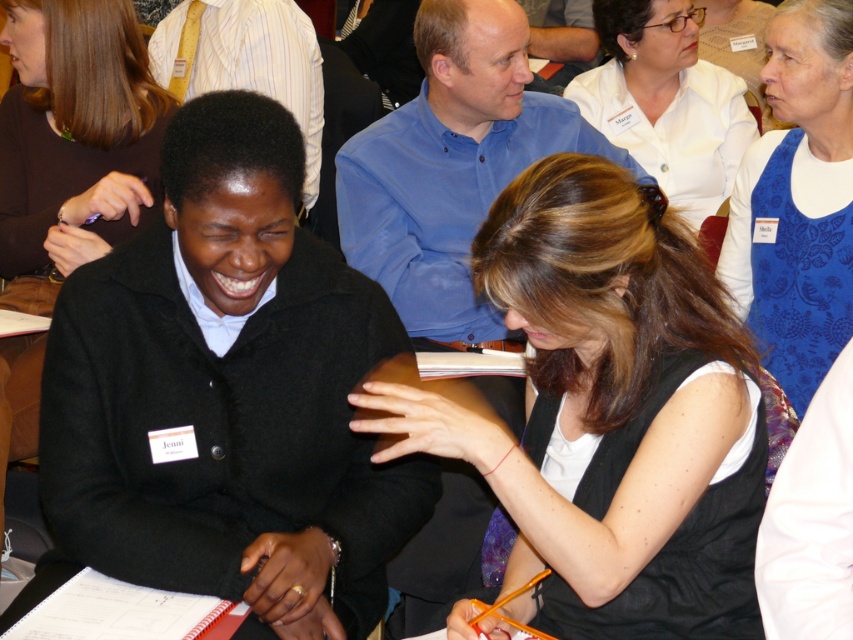
You are a tailor who needs to determine if a new button can be sewn onto the matte black vest at center without overlapping the white matte shirt at upper center. Based on their widths, can you safely add the button?

The matte black vest at center might be wider than white matte shirt at upper center, so there is a possibility that adding a button won t overlap the shirt. However, since the width comparison is uncertain, it s advisable to measure the exact dimensions before proceeding.